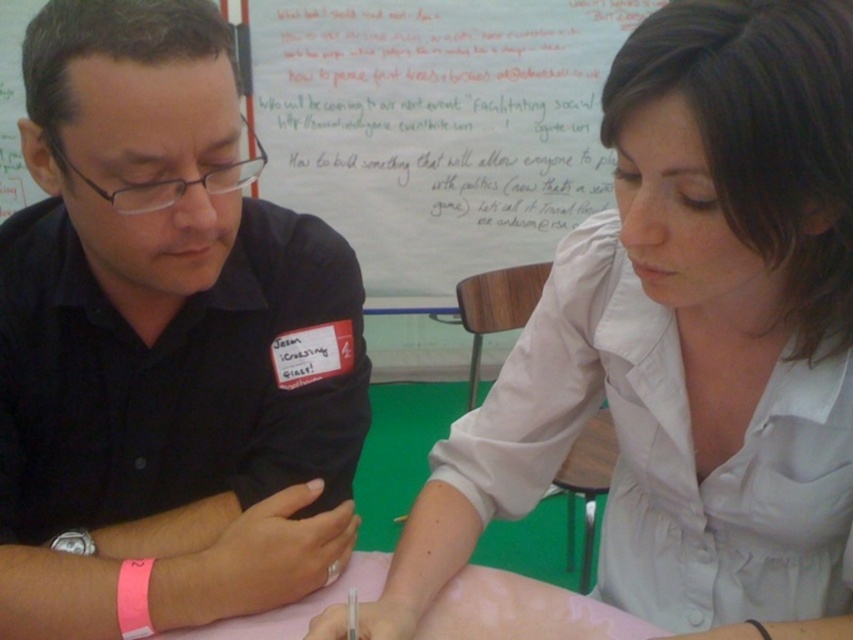
Is point (810, 481) closer to camera compared to point (526, 86)?

Yes, it is in front of point (526, 86).

Measure the distance between point (634, 554) and camera.

Point (634, 554) is 3.31 feet from camera.

What do you see at coordinates (688, 340) in the screenshot? I see `light beige shirt at center` at bounding box center [688, 340].

Image resolution: width=853 pixels, height=640 pixels. In order to click on light beige shirt at center in this screenshot , I will do `click(688, 340)`.

Between black shirt at left and light beige shirt at center, which one appears on the left side from the viewer's perspective?

Positioned to the left is black shirt at left.

Which is more to the right, black shirt at left or light beige shirt at center?

Positioned to the right is light beige shirt at center.

At what (x,y) coordinates should I click in order to perform the action: click on black shirt at left. Please return your answer as a coordinate pair (x, y). This screenshot has width=853, height=640. Looking at the image, I should click on (164, 344).

Which is in front, point (126, 520) or point (450, 609)?

Point (450, 609) is more forward.

In the scene shown: Who is lower down, black shirt at left or pink paper at center?

pink paper at center is lower down.

Where is `black shirt at left`? black shirt at left is located at coordinates (164, 344).